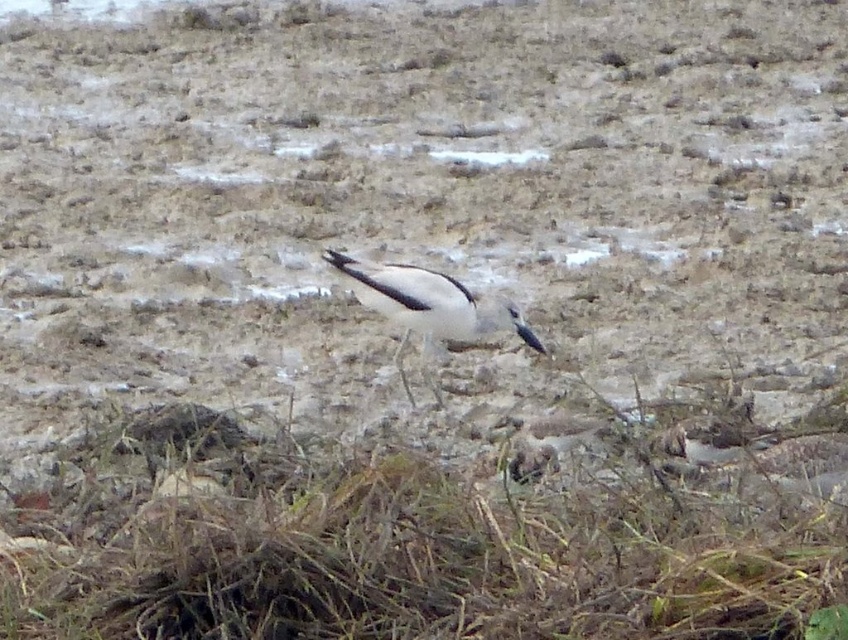
Which is above, brown dry grass at lower center or white matte bird at center?

white matte bird at center

Is brown dry grass at lower center thinner than white matte bird at center?

In fact, brown dry grass at lower center might be wider than white matte bird at center.

Describe the element at coordinates (434, 548) in the screenshot. Image resolution: width=848 pixels, height=640 pixels. I see `brown dry grass at lower center` at that location.

I want to click on brown dry grass at lower center, so click(434, 548).